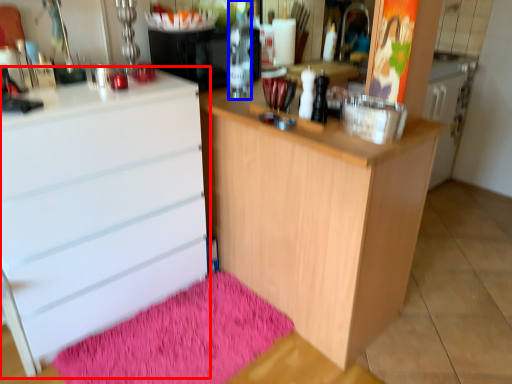
Question: Which point is further to the camera, chest of drawers (highlighted by a red box) or bottle (highlighted by a blue box)?

Choices:
 (A) chest of drawers
 (B) bottle

Answer: (B)